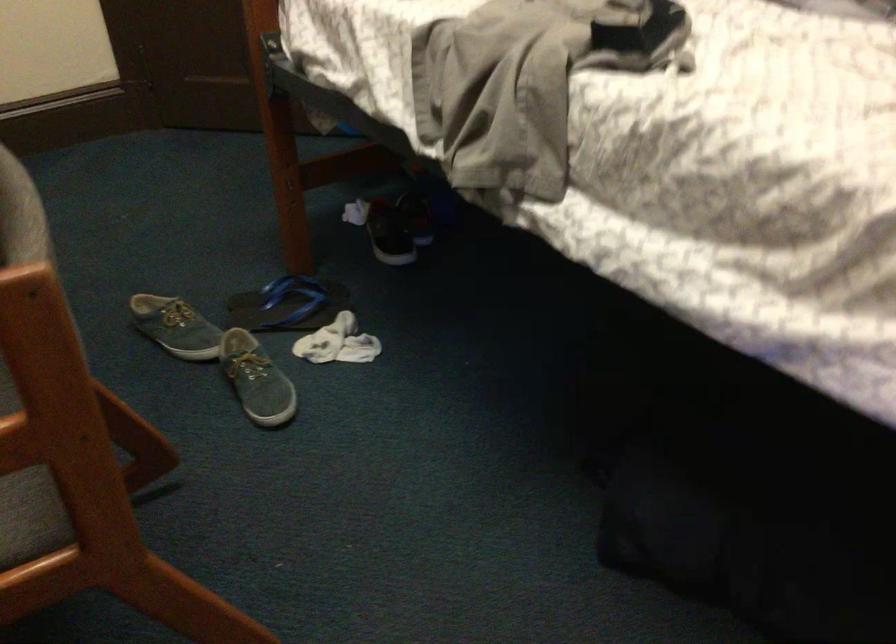
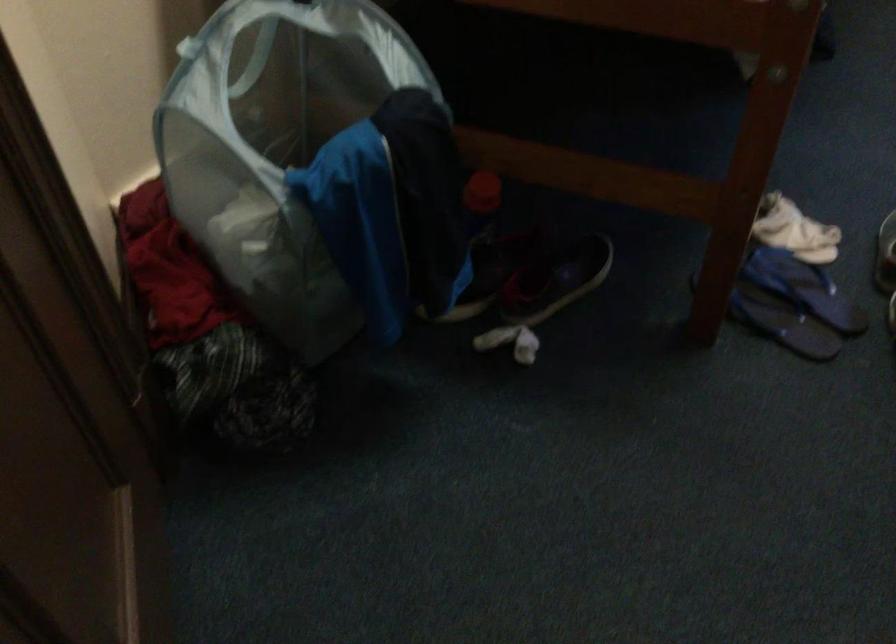
The point at (x=280, y=319) is marked in the first image. Where is the corresponding point in the second image?

(804, 288)